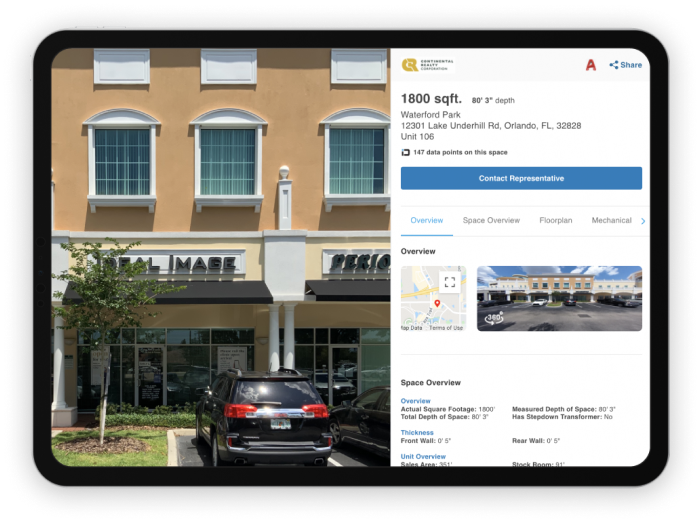
Where is `pillars`? The width and height of the screenshot is (700, 523). pillars is located at coordinates (57, 382), (274, 332), (290, 332).